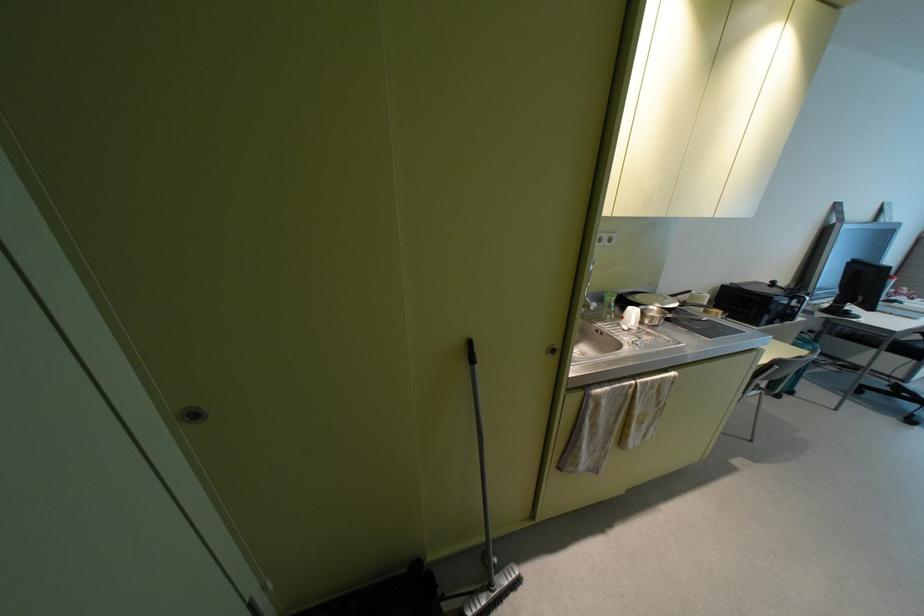
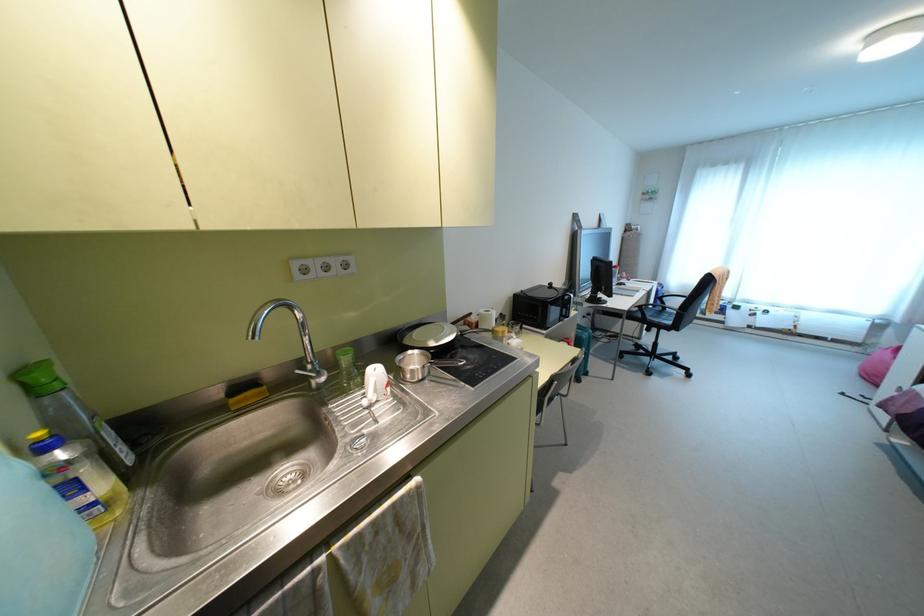
Question: The camera is either moving clockwise (left) or counter-clockwise (right) around the object. The first image is from the beginning of the video and the second image is from the end. Is the camera moving left or right when shooting the video?

Choices:
 (A) Left
 (B) Right

Answer: (A)